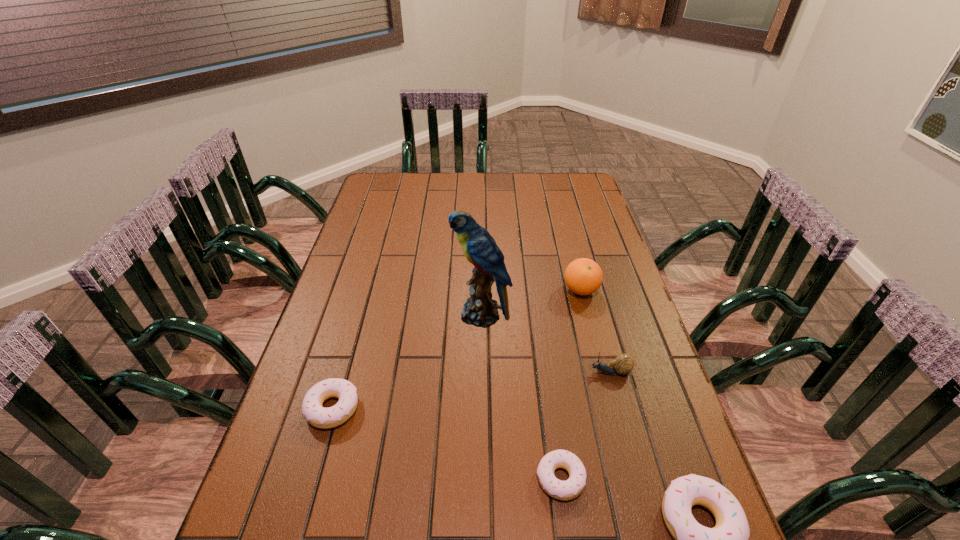
At what (x,y) coordinates should I click in order to perform the action: click on free space located 0.330m on the front of the fifth shortest object. Please return your answer as a coordinate pair (x, y). Looking at the image, I should click on (609, 398).

Locate an element on the screen. This screenshot has width=960, height=540. vacant space located 0.230m on the face of the parrot is located at coordinates (374, 314).

Find the location of a particular element. Image resolution: width=960 pixels, height=540 pixels. free space located on the face of the parrot is located at coordinates (401, 314).

The height and width of the screenshot is (540, 960). In order to click on free space located on the face of the parrot in this screenshot , I will do `click(381, 314)`.

This screenshot has width=960, height=540. Identify the location of vacant space situated on the front-facing side of the third farthest object. (537, 372).

At what (x,y) coordinates should I click in order to perform the action: click on vacant space situated 0.260m on the front-facing side of the third farthest object. Please return your answer as a coordinate pair (x, y). Looking at the image, I should click on (486, 372).

The height and width of the screenshot is (540, 960). What are the coordinates of `free space located 0.300m on the front-facing side of the third farthest object` in the screenshot? It's located at (470, 372).

Where is `object located in the near edge section of the desktop`? This screenshot has height=540, width=960. object located in the near edge section of the desktop is located at coordinates (566, 490).

Locate an element on the screen. The width and height of the screenshot is (960, 540). object positioned at the left edge is located at coordinates (318, 416).

The image size is (960, 540). I want to click on orange that is at the right edge, so click(583, 276).